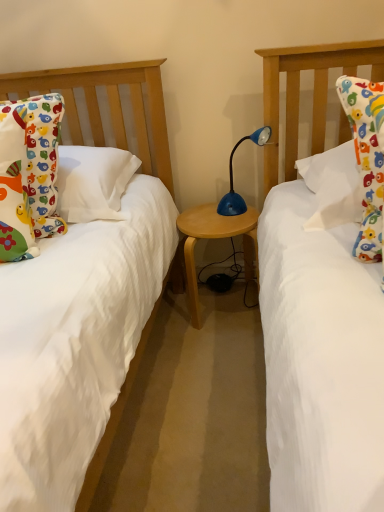
You are a GUI agent. You are given a task and a screenshot of the screen. Output one action in this format:
    pyautogui.click(x=<x>, y=<y>)
    Task: Click on the wooden table at center
    This screenshot has height=512, width=384.
    Given the screenshot: What is the action you would take?
    pyautogui.click(x=216, y=238)

What is the approximate height of matte cotton pillow at left?

22.23 inches.

Where is `matte cotton pillow at left`? matte cotton pillow at left is located at coordinates (44, 161).

You are a GUI agent. You are given a task and a screenshot of the screen. Output one action in this format:
    pyautogui.click(x=<x>, y=<y>)
    Task: Click on the wooden table at center
    This screenshot has width=384, height=512.
    Given the screenshot: What is the action you would take?
    pyautogui.click(x=216, y=238)

From a real-world perspective, which is physically above, wooden table at center or blue plastic lamp at center?

blue plastic lamp at center, from a real-world perspective.

Find the location of a particular element. lamp above the wooden table at center (from the image's perspective) is located at coordinates (232, 176).

Considering the positions of objects wooden table at center and blue plastic lamp at center in the image provided, who is more to the right, wooden table at center or blue plastic lamp at center?

Positioned to the right is blue plastic lamp at center.

From the picture: Is wooden table at center next to blue plastic lamp at center and touching it?

wooden table at center and blue plastic lamp at center are not in contact.

Is matte cotton pillow at left located within wooden table at center?

No, matte cotton pillow at left is not a part of wooden table at center.

Considering the points (195, 266) and (56, 97), which point is behind, point (195, 266) or point (56, 97)?

The point (195, 266) is farther.

Are wooden table at center and matte cotton pillow at left far apart?

That's not correct — wooden table at center is a little close to matte cotton pillow at left.

From the image's perspective, relative to blue plastic lamp at center, is matte cotton pillow at left above or below?

From the image's perspective, matte cotton pillow at left appears below blue plastic lamp at center.

Does matte cotton pillow at left have a larger size compared to blue plastic lamp at center?

Indeed, matte cotton pillow at left has a larger size compared to blue plastic lamp at center.

In the scene shown: Is there a large distance between matte cotton pillow at left and blue plastic lamp at center?

That's not correct — matte cotton pillow at left is a little close to blue plastic lamp at center.

Considering the points (35, 121) and (231, 194), which point is behind, point (35, 121) or point (231, 194)?

The point (231, 194) is farther from the camera.

Considering the sizes of objects matte cotton pillow at left and wooden table at center in the image provided, who is shorter, matte cotton pillow at left or wooden table at center?

Standing shorter between the two is wooden table at center.

From the image's perspective, between matte cotton pillow at left and wooden table at center, which one is located above?

matte cotton pillow at left is shown above in the image.

Between matte cotton pillow at left and wooden table at center, which one has smaller size?

With smaller size is matte cotton pillow at left.

Does matte cotton pillow at left appear on the right side of wooden table at center?

No, matte cotton pillow at left is not to the right of wooden table at center.

Which object is further away from the camera, blue plastic lamp at center or matte cotton pillow at left?

blue plastic lamp at center is more distant.

Can you tell me how much blue plastic lamp at center and matte cotton pillow at left differ in facing direction?

40.1 degrees separate the facing orientations of blue plastic lamp at center and matte cotton pillow at left.

From the image's perspective, is blue plastic lamp at center under matte cotton pillow at left?

No.

Can you confirm if blue plastic lamp at center is positioned to the right of matte cotton pillow at left?

Yes, blue plastic lamp at center is to the right of matte cotton pillow at left.

Between blue plastic lamp at center and wooden table at center, which one appears on the left side from the viewer's perspective?

Positioned to the left is wooden table at center.

From the picture: Considering the positions of objects blue plastic lamp at center and wooden table at center in the image provided, who is behind, blue plastic lamp at center or wooden table at center?

wooden table at center is behind.

Which of these two, blue plastic lamp at center or wooden table at center, stands taller?

With more height is wooden table at center.

How far apart are blue plastic lamp at center and wooden table at center?

blue plastic lamp at center is 6.34 inches from wooden table at center.

The height and width of the screenshot is (512, 384). What are the coordinates of `lamp that is above the wooden table at center (from a real-world perspective)` in the screenshot? It's located at (232, 176).

This screenshot has height=512, width=384. Find the location of `table located underneath the matte cotton pillow at left (from a real-world perspective)`. table located underneath the matte cotton pillow at left (from a real-world perspective) is located at coordinates (216, 238).

Estimate the real-world distances between objects in this image. Which object is further from matte cotton pillow at left, wooden table at center or blue plastic lamp at center?

Among the two, blue plastic lamp at center is located further to matte cotton pillow at left.

Which object lies further to the anchor point blue plastic lamp at center, matte cotton pillow at left or wooden table at center?

matte cotton pillow at left lies further to blue plastic lamp at center than the other object.

From the image, which object appears to be nearer to blue plastic lamp at center, wooden table at center or matte cotton pillow at left?

Based on the image, wooden table at center appears to be nearer to blue plastic lamp at center.

Considering their positions, is blue plastic lamp at center positioned further to matte cotton pillow at left than wooden table at center?

blue plastic lamp at center lies further to matte cotton pillow at left than the other object.

Considering their positions, is blue plastic lamp at center positioned closer to wooden table at center than matte cotton pillow at left?

blue plastic lamp at center is positioned closer to the anchor wooden table at center.

Estimate the real-world distances between objects in this image. Which object is closer to wooden table at center, matte cotton pillow at left or blue plastic lamp at center?

blue plastic lamp at center lies closer to wooden table at center than the other object.

Where is `table between matte cotton pillow at left and blue plastic lamp at center in the horizontal direction`? The image size is (384, 512). table between matte cotton pillow at left and blue plastic lamp at center in the horizontal direction is located at coordinates (216, 238).